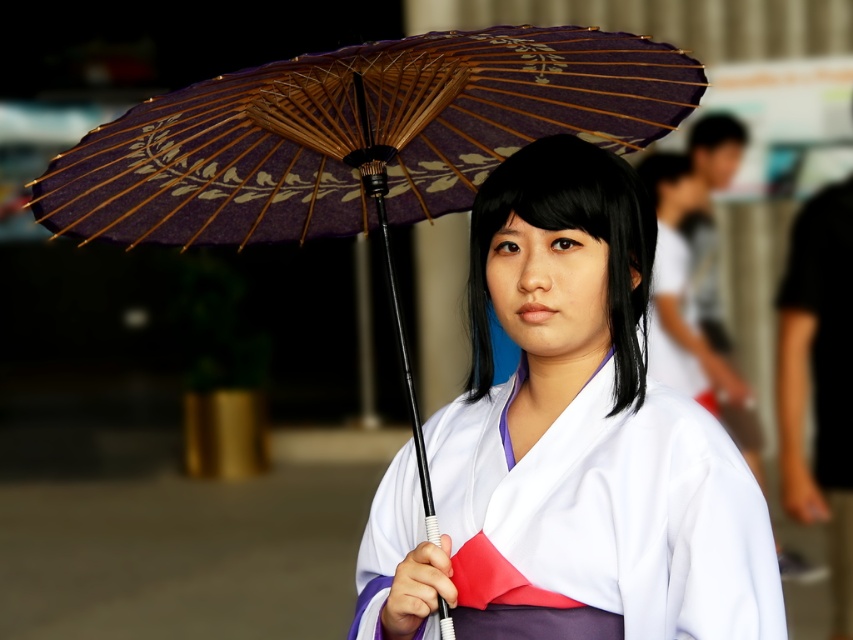
Can you confirm if matte purple kimono at center is bigger than black matte hair at center?

Yes.

Who is taller, matte purple kimono at center or black matte hair at center?

matte purple kimono at center

Is point (680, 445) less distant than point (515, 204)?

Yes, it is.

Identify the location of matte purple kimono at center. (570, 440).

I want to click on black matte hair at center, so click(x=569, y=228).

Consider the image. Who is higher up, black matte hair at center or smooth skin head at upper right?

smooth skin head at upper right

Does point (564, 170) come in front of point (722, 161)?

Yes, point (564, 170) is in front of point (722, 161).

Where is `black matte hair at center`? The height and width of the screenshot is (640, 853). black matte hair at center is located at coordinates (569, 228).

Measure the distance between matte purple kimono at center and camera.

matte purple kimono at center is 2.09 meters away from camera.

Does matte purple kimono at center have a greater height compared to matte black hair at upper center?

Indeed, matte purple kimono at center has a greater height compared to matte black hair at upper center.

You are a GUI agent. You are given a task and a screenshot of the screen. Output one action in this format:
    pyautogui.click(x=<x>, y=<y>)
    Task: Click on the matte purple kimono at center
    The height and width of the screenshot is (640, 853).
    Given the screenshot: What is the action you would take?
    pyautogui.click(x=570, y=440)

The width and height of the screenshot is (853, 640). Find the location of `matte purple kimono at center`. matte purple kimono at center is located at coordinates (570, 440).